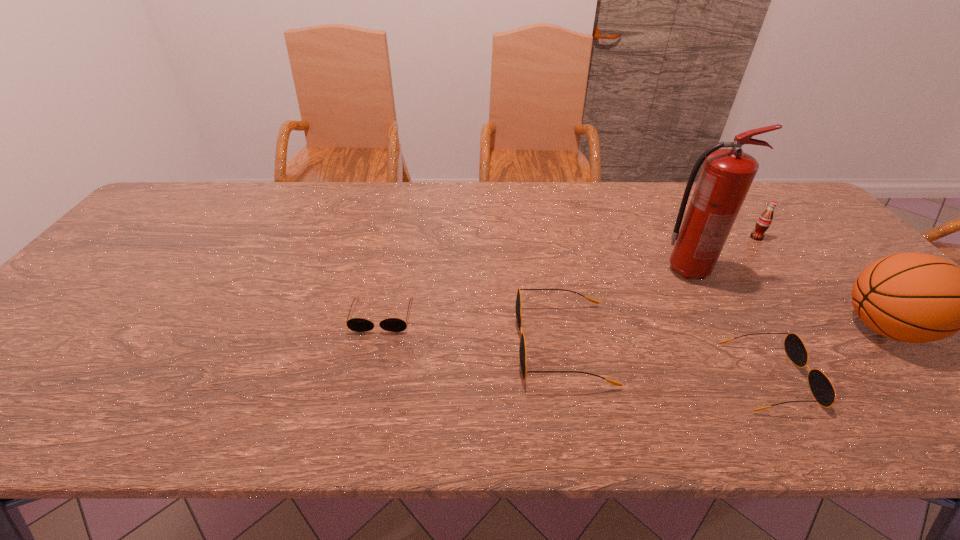
This screenshot has height=540, width=960. In order to click on basketball present at the near edge in this screenshot , I will do `click(911, 297)`.

At what (x,y) coordinates should I click in order to perform the action: click on object at the right edge. Please return your answer as a coordinate pair (x, y). Looking at the image, I should click on (911, 297).

Find the location of a particular element. Image resolution: width=960 pixels, height=540 pixels. object present at the near right corner is located at coordinates (911, 297).

Where is `vacant space at the far edge`? vacant space at the far edge is located at coordinates (474, 187).

At what (x,y) coordinates should I click in order to perform the action: click on free space at the near edge of the desktop. Please return your answer as a coordinate pair (x, y). The width and height of the screenshot is (960, 540). Looking at the image, I should click on [764, 381].

You are a GUI agent. You are given a task and a screenshot of the screen. Output one action in this format:
    pyautogui.click(x=<x>, y=<y>)
    Task: Click on the free space at the left edge of the desktop
    The height and width of the screenshot is (540, 960).
    Given the screenshot: What is the action you would take?
    pyautogui.click(x=56, y=308)

Where is `vacant space at the right edge`? vacant space at the right edge is located at coordinates (880, 342).

Find the location of a particular element. The height and width of the screenshot is (540, 960). free spot at the near left corner of the desktop is located at coordinates (23, 360).

Identify the location of empty space between the tallest object and the third tallest object. (722, 254).

You are a GUI agent. You are given a task and a screenshot of the screen. Output one action in this format:
    pyautogui.click(x=<x>, y=<y>)
    Task: Click on the free space that is in between the rightmost object and the shortest sunglasses
    This screenshot has width=960, height=540.
    Given the screenshot: What is the action you would take?
    pyautogui.click(x=633, y=321)